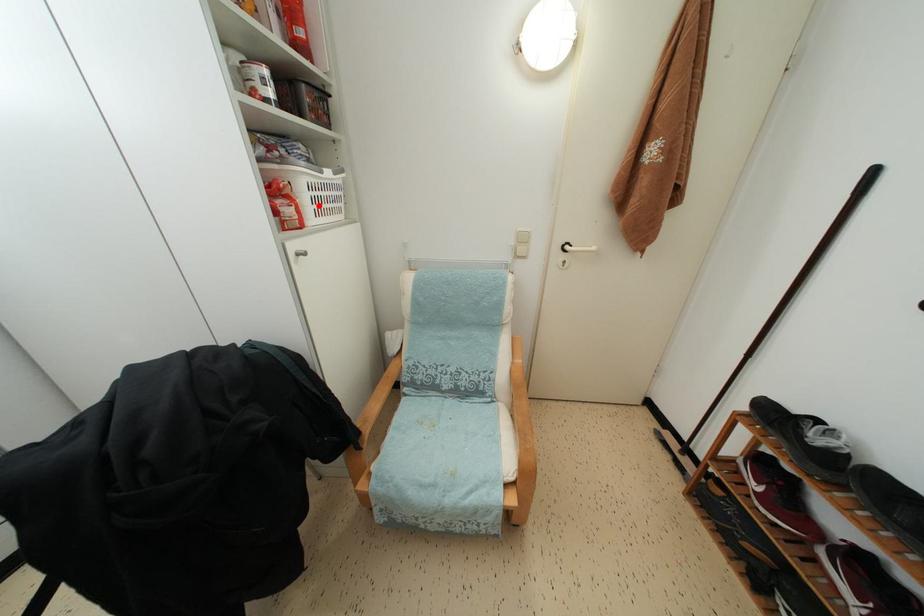
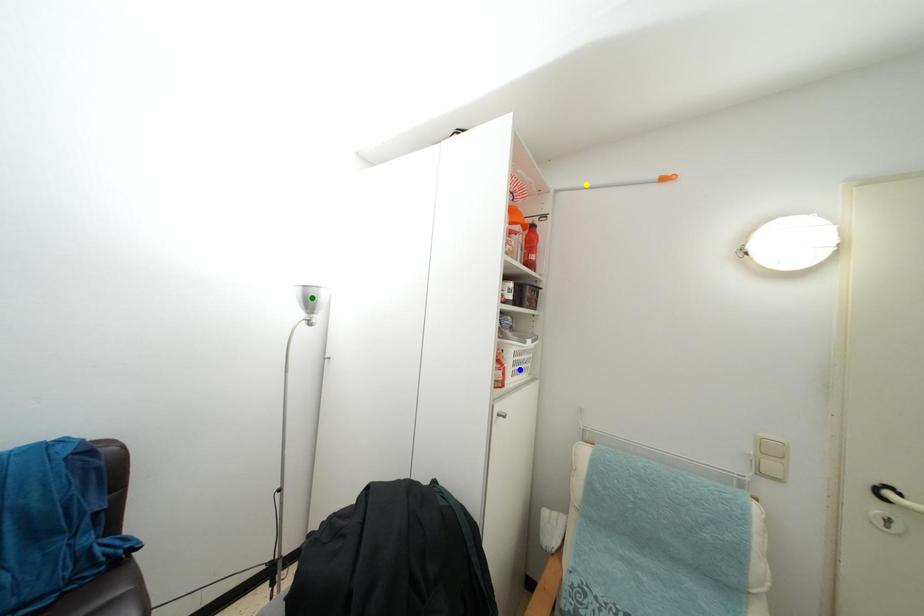
Question: I am providing you with two images of the same scene from different viewpoints. A red point is marked on the first image. You are given multiple points on the second image. Which mark in image 2 goes with the point in image 1?

Choices:
 (A) blue point
 (B) yellow point
 (C) green point

Answer: (A)